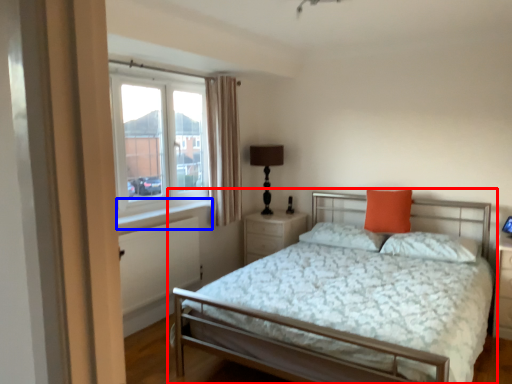
Question: Which point is further to the camera, bed (highlighted by a red box) or window sill (highlighted by a blue box)?

Choices:
 (A) bed
 (B) window sill

Answer: (B)